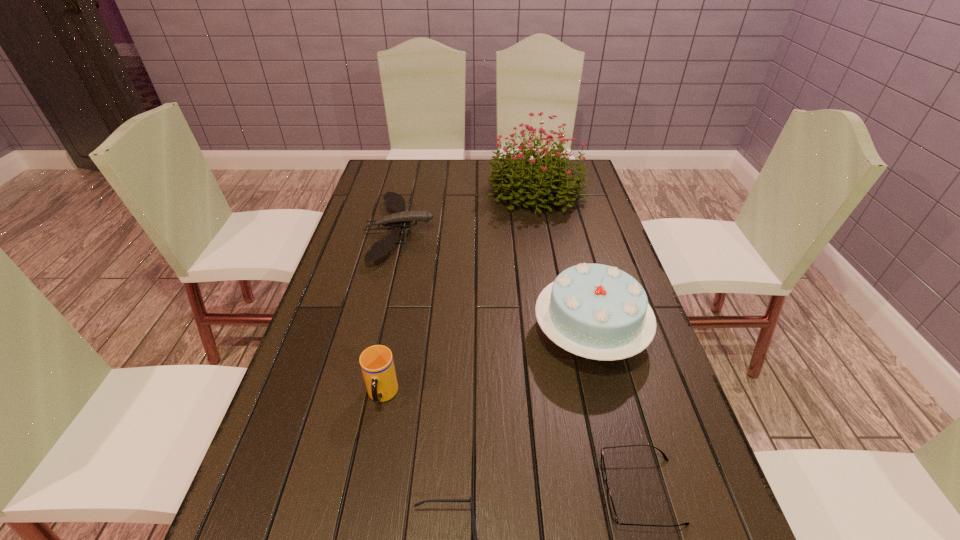
Find the location of `free space located on the front-facing side of the shorter spectacles`. free space located on the front-facing side of the shorter spectacles is located at coordinates (426, 491).

Identify the location of vacant area situated 0.170m on the front-facing side of the shorter spectacles. (512, 491).

Image resolution: width=960 pixels, height=540 pixels. What are the coordinates of `vacant space located on the front-facing side of the shorter spectacles` in the screenshot? It's located at (495, 491).

Locate an element on the screen. The image size is (960, 540). object that is positioned at the far edge is located at coordinates (550, 175).

The image size is (960, 540). Identify the location of object situated at the left edge. (393, 200).

At what (x,y) coordinates should I click in order to perform the action: click on bouquet that is at the right edge. Please return your answer as a coordinate pair (x, y). Looking at the image, I should click on pyautogui.click(x=550, y=175).

The image size is (960, 540). What are the coordinates of `birthday cake that is at the right edge` in the screenshot? It's located at (596, 311).

Find the location of a particular element. This screenshot has height=540, width=960. spectacles situated at the right edge is located at coordinates click(x=609, y=498).

Locate an element on the screen. This screenshot has width=960, height=540. object situated at the far right corner is located at coordinates coord(550,175).

You are a GUI agent. You are given a task and a screenshot of the screen. Output one action in this format:
    pyautogui.click(x=<x>, y=<y>)
    Task: Click on the free space at the far edge
    Image resolution: width=960 pixels, height=540 pixels.
    Given the screenshot: What is the action you would take?
    pyautogui.click(x=476, y=172)